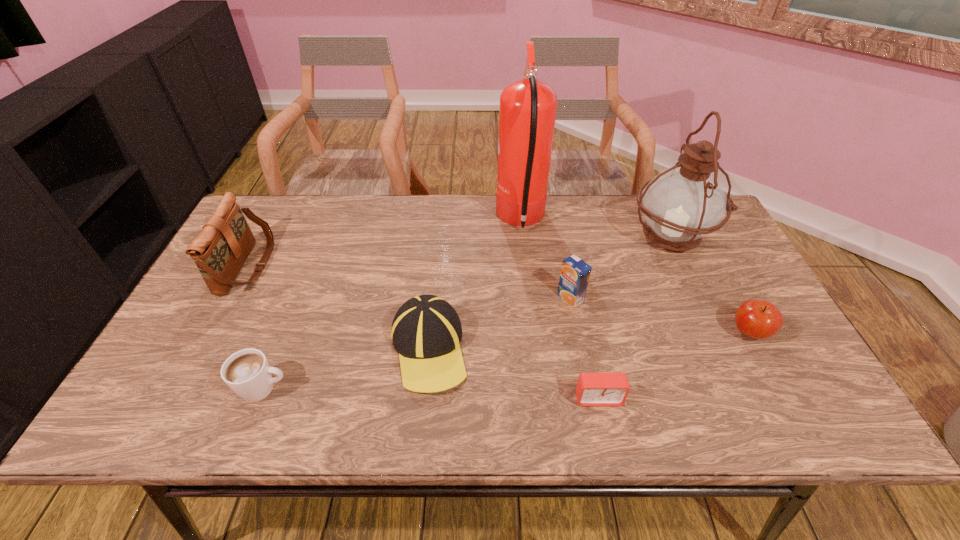
The image size is (960, 540). What are the coordinates of `fire extinguisher` in the screenshot? It's located at 527,111.

Locate an element on the screen. Image resolution: width=960 pixels, height=540 pixels. the second tallest object is located at coordinates tap(680, 205).

Locate an element on the screen. the sixth shortest object is located at coordinates (220, 250).

Image resolution: width=960 pixels, height=540 pixels. What are the coordinates of `the leftmost object` in the screenshot? It's located at (220, 250).

Image resolution: width=960 pixels, height=540 pixels. Find the location of `orange_juice`. orange_juice is located at coordinates tap(575, 273).

Locate an element on the screen. The image size is (960, 540). baseball cap is located at coordinates (426, 331).

Find the location of a particular element. apple is located at coordinates (758, 319).

In order to click on cappuccino in this screenshot , I will do `click(247, 372)`.

In order to click on alarm clock in this screenshot , I will do `click(592, 389)`.

Locate an element on the screen. Image resolution: width=960 pixels, height=540 pixels. vacant space located 0.180m towards the nozzle of the tallest object is located at coordinates (440, 220).